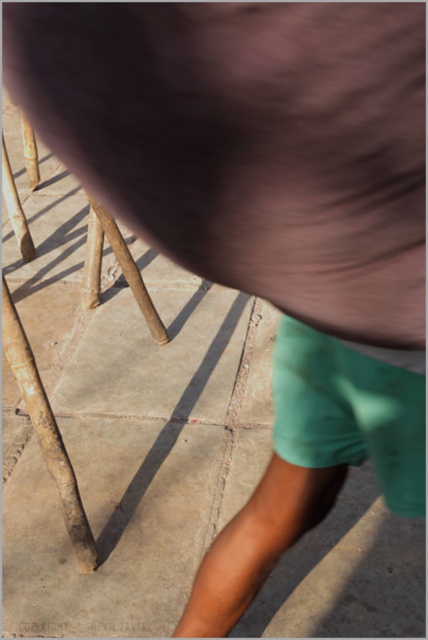
Between green cotton shorts at lower right and brown wooden pole at lower left, which one has more height?

brown wooden pole at lower left

Is green cotton shorts at lower right smaller than brown wooden pole at lower left?

Yes.

What do you see at coordinates (350, 412) in the screenshot? This screenshot has width=428, height=640. I see `green cotton shorts at lower right` at bounding box center [350, 412].

Image resolution: width=428 pixels, height=640 pixels. Identify the location of green cotton shorts at lower right. (x=350, y=412).